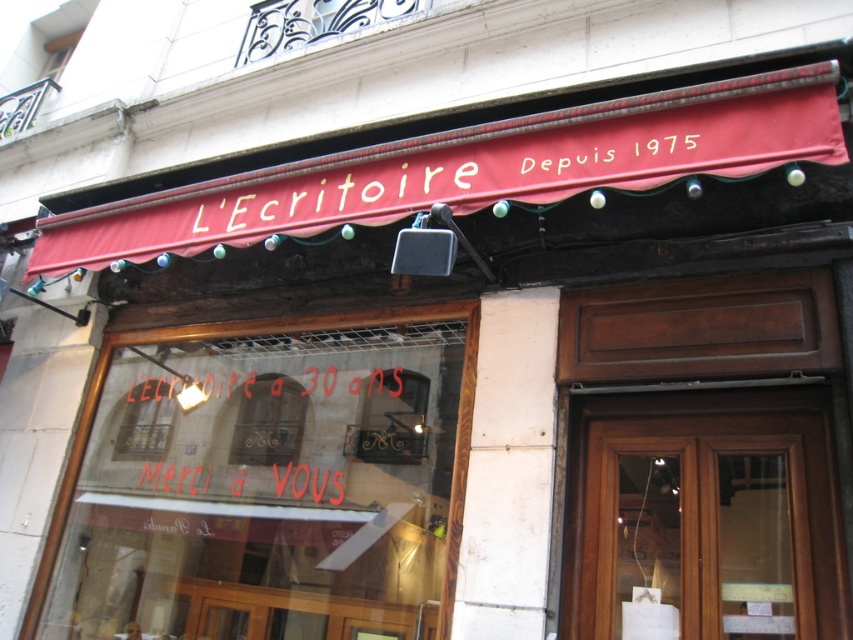
Question: Which object appears closest to the camera in this image?

Choices:
 (A) red painted text at center
 (B) brown wooden door at center
 (C) gold text sign at upper center

Answer: (B)

Question: Is brown wooden door at center above red painted text at center?

Choices:
 (A) no
 (B) yes

Answer: (A)

Question: Among these points, which one is farthest from the camera?

Choices:
 (A) (817, 576)
 (B) (322, 198)
 (C) (312, 451)

Answer: (C)

Question: Is brown wooden door at center wider than red painted text at center?

Choices:
 (A) yes
 (B) no

Answer: (B)

Question: Estimate the real-world distances between objects in this image. Which object is farther from the red painted text at center?

Choices:
 (A) brown wooden door at center
 (B) gold text sign at upper center

Answer: (A)

Question: Is red painted text at center to the right of gold text sign at upper center from the viewer's perspective?

Choices:
 (A) no
 (B) yes

Answer: (A)